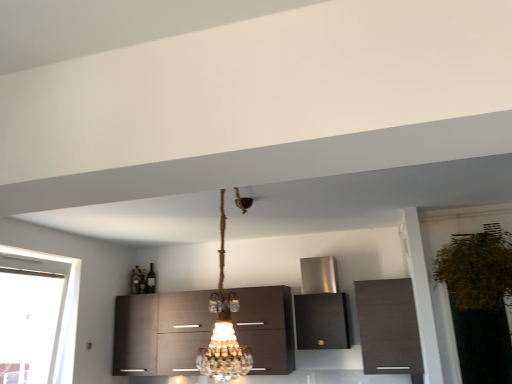
Question: From a real-world perspective, is dark wood cabinet at center, marked as the third cabinetry in a right-to-left arrangement, positioned over green leafy plant at right based on gravity?

Choices:
 (A) no
 (B) yes

Answer: (A)

Question: Does dark wood cabinet at center, which ranks as the 1th cabinetry in left-to-right order, appear on the left side of green leafy plant at right?

Choices:
 (A) no
 (B) yes

Answer: (B)

Question: Does dark wood cabinet at center, marked as the third cabinetry in a right-to-left arrangement, have a lesser width compared to green leafy plant at right?

Choices:
 (A) yes
 (B) no

Answer: (A)

Question: Would you say green leafy plant at right is part of dark wood cabinet at center, which ranks as the 1th cabinetry in left-to-right order,'s contents?

Choices:
 (A) yes
 (B) no

Answer: (B)

Question: Considering the relative sizes of dark wood cabinet at center, which ranks as the 1th cabinetry in left-to-right order, and green leafy plant at right in the image provided, is dark wood cabinet at center, which ranks as the 1th cabinetry in left-to-right order, shorter than green leafy plant at right?

Choices:
 (A) no
 (B) yes

Answer: (B)

Question: Does dark wood cabinet at center, which ranks as the 1th cabinetry in left-to-right order, have a smaller size compared to green leafy plant at right?

Choices:
 (A) yes
 (B) no

Answer: (B)

Question: Considering the relative sizes of matte brown cabinet at upper right, the first cabinetry positioned from the right, and dark wood cabinet at center, marked as the third cabinetry in a right-to-left arrangement, in the image provided, is matte brown cabinet at upper right, the first cabinetry positioned from the right, taller than dark wood cabinet at center, marked as the third cabinetry in a right-to-left arrangement,?

Choices:
 (A) no
 (B) yes

Answer: (A)

Question: From the image's perspective, is matte brown cabinet at upper right, which appears as the third cabinetry when viewed from the left, located above dark wood cabinet at center, which ranks as the 1th cabinetry in left-to-right order?

Choices:
 (A) no
 (B) yes

Answer: (B)

Question: From a real-world perspective, does matte brown cabinet at upper right, which appears as the third cabinetry when viewed from the left, sit lower than dark wood cabinet at center, which ranks as the 1th cabinetry in left-to-right order?

Choices:
 (A) yes
 (B) no

Answer: (A)

Question: Is matte brown cabinet at upper right, the first cabinetry positioned from the right, behind dark wood cabinet at center, marked as the third cabinetry in a right-to-left arrangement?

Choices:
 (A) no
 (B) yes

Answer: (A)

Question: From the image's perspective, is matte brown cabinet at upper right, which appears as the third cabinetry when viewed from the left, beneath dark wood cabinet at center, which ranks as the 1th cabinetry in left-to-right order?

Choices:
 (A) yes
 (B) no

Answer: (B)

Question: Is matte brown cabinet at upper right, which appears as the third cabinetry when viewed from the left, to the right of dark wood cabinet at center, marked as the third cabinetry in a right-to-left arrangement, from the viewer's perspective?

Choices:
 (A) yes
 (B) no

Answer: (A)

Question: From a real-world perspective, does green leafy plant at right sit lower than matte brown cabinet at upper right, which appears as the third cabinetry when viewed from the left?

Choices:
 (A) no
 (B) yes

Answer: (A)